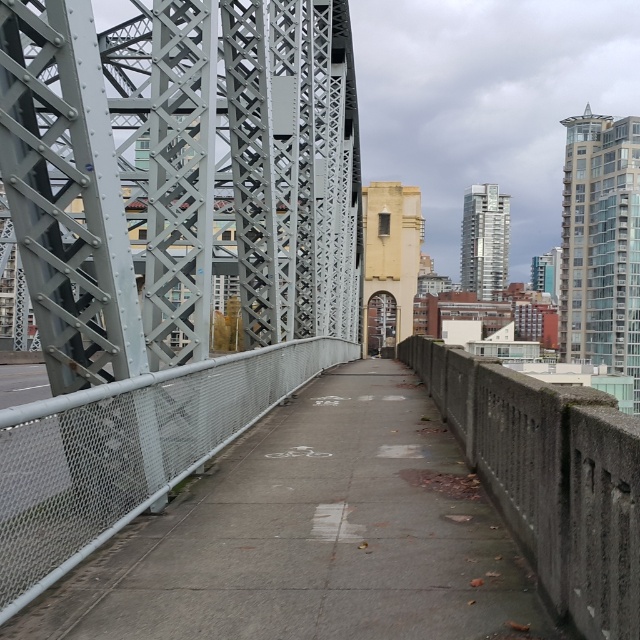
Question: Does metallic gray bridge at center have a lesser width compared to gray concrete pavement at center?

Choices:
 (A) no
 (B) yes

Answer: (A)

Question: Which point is closer to the camera?

Choices:
 (A) gray concrete pavement at center
 (B) metallic gray bridge at center

Answer: (A)

Question: Considering the relative positions of metallic gray bridge at center and gray concrete pavement at center in the image provided, where is metallic gray bridge at center located with respect to gray concrete pavement at center?

Choices:
 (A) left
 (B) right

Answer: (A)

Question: Among these points, which one is farthest from the camera?

Choices:
 (A) (234, 385)
 (B) (326, 520)

Answer: (A)

Question: Among these points, which one is nearest to the camera?

Choices:
 (A) (339, 444)
 (B) (198, 280)

Answer: (B)

Question: Does metallic gray bridge at center appear under gray concrete pavement at center?

Choices:
 (A) yes
 (B) no

Answer: (B)